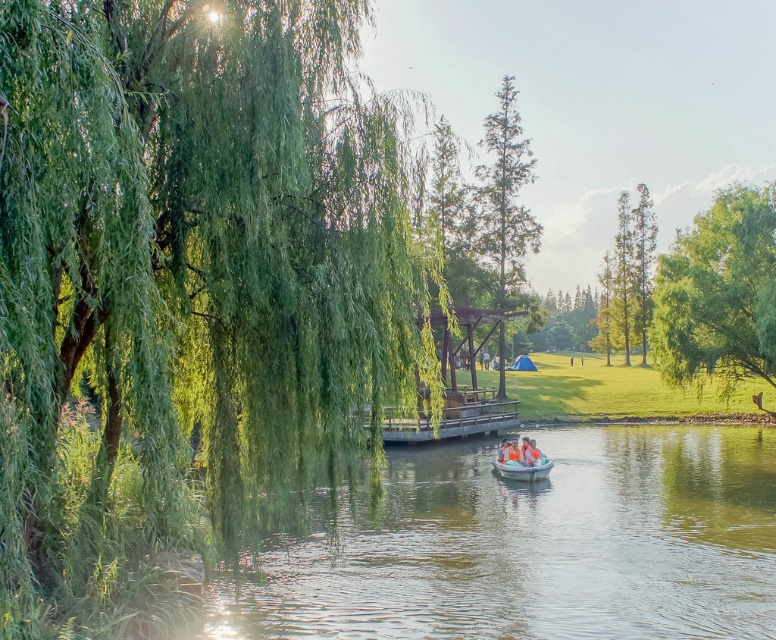
Question: Can you confirm if green smooth tree at upper right is thinner than orange fabric canoe at center?

Choices:
 (A) yes
 (B) no

Answer: (B)

Question: From the image, what is the correct spatial relationship of green leafy tree at right in relation to green smooth tree at upper right?

Choices:
 (A) above
 (B) below

Answer: (B)

Question: Which object appears farthest from the camera in this image?

Choices:
 (A) green leafy tree at right
 (B) green leafy willow at left
 (C) green smooth tree at upper right

Answer: (C)

Question: Which point is closer to the camera taking this photo?

Choices:
 (A) (646, 205)
 (B) (709, 268)
 (C) (515, 208)

Answer: (B)

Question: Which point is farther to the camera?

Choices:
 (A) (26, 394)
 (B) (721, 378)
 (C) (501, 177)

Answer: (C)

Question: Can you confirm if green leafy willow at left is bigger than green leafy tree at center?

Choices:
 (A) yes
 (B) no

Answer: (B)